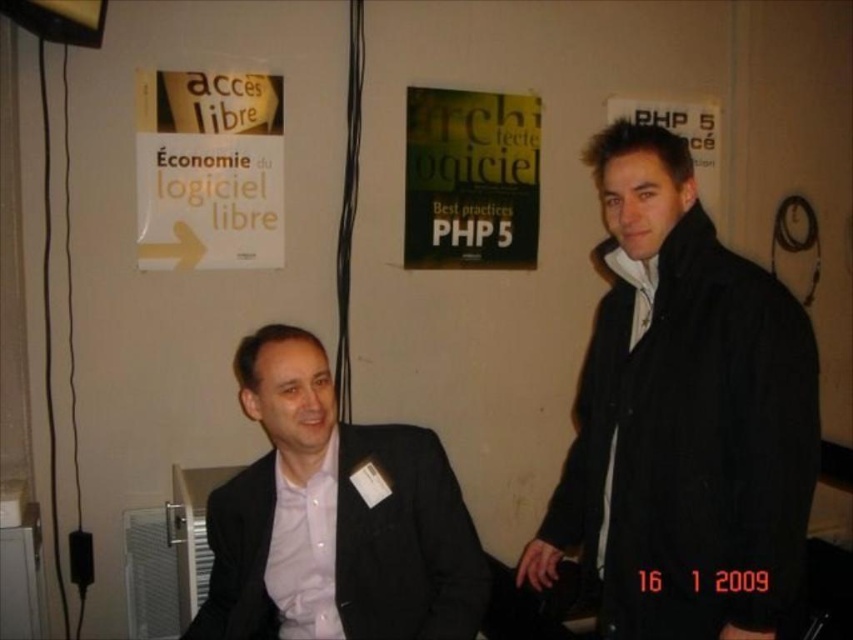
Question: Is black matte suit at left closer to camera compared to white paper poster at upper left?

Choices:
 (A) yes
 (B) no

Answer: (A)

Question: Which object appears closest to the camera in this image?

Choices:
 (A) green matte book at center
 (B) black matte jacket at right
 (C) white paper poster at upper left

Answer: (B)

Question: Is white paper poster at upper left below green matte book at center?

Choices:
 (A) no
 (B) yes

Answer: (B)

Question: Does black matte jacket at right lie in front of green matte book at center?

Choices:
 (A) yes
 (B) no

Answer: (A)

Question: Which of the following is the closest to the observer?

Choices:
 (A) (717, 147)
 (B) (448, 256)
 (C) (610, 243)
 (D) (231, 627)

Answer: (D)

Question: Which point appears closest to the camera in this image?

Choices:
 (A) (503, 106)
 (B) (776, 328)
 (C) (196, 221)

Answer: (B)